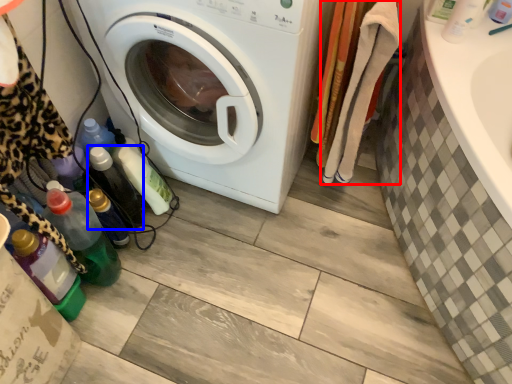
Question: Which object appears closest to the camera in this image, clothing (highlighted by a red box) or bottle (highlighted by a blue box)?

Choices:
 (A) clothing
 (B) bottle

Answer: (A)